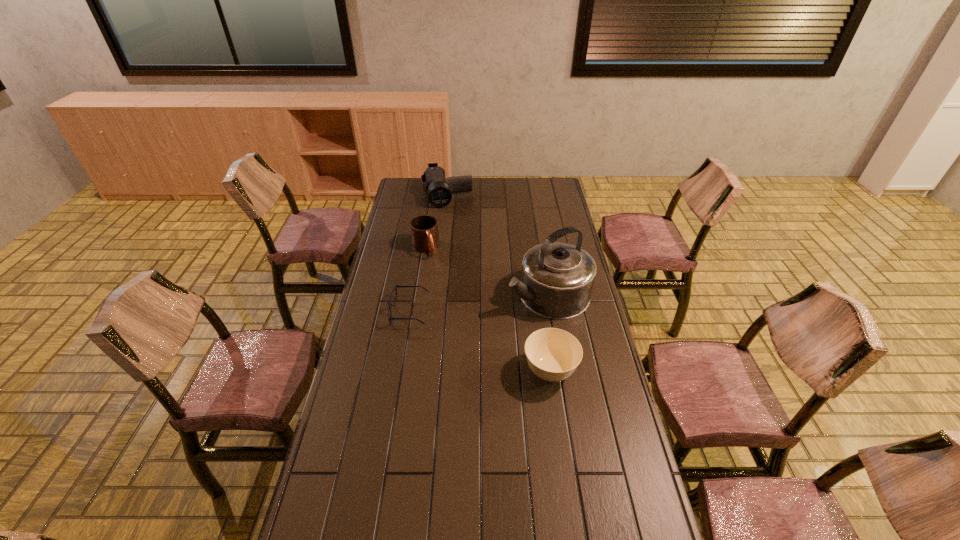
The image size is (960, 540). I want to click on vacant space on the desktop that is between the spectacles and the sugar bowl and is positioned on the lens of the farthest object, so click(481, 342).

Identify the location of vacant space on the desktop that is between the spectacles and the sugar bowl and is positioned with the spout at the front of the tallest object. This screenshot has width=960, height=540. (461, 334).

Locate an element on the screen. The width and height of the screenshot is (960, 540). vacant space on the desktop that is between the shortest object and the nearest object and is positioned on the side of the mug with the handle is located at coordinates (468, 337).